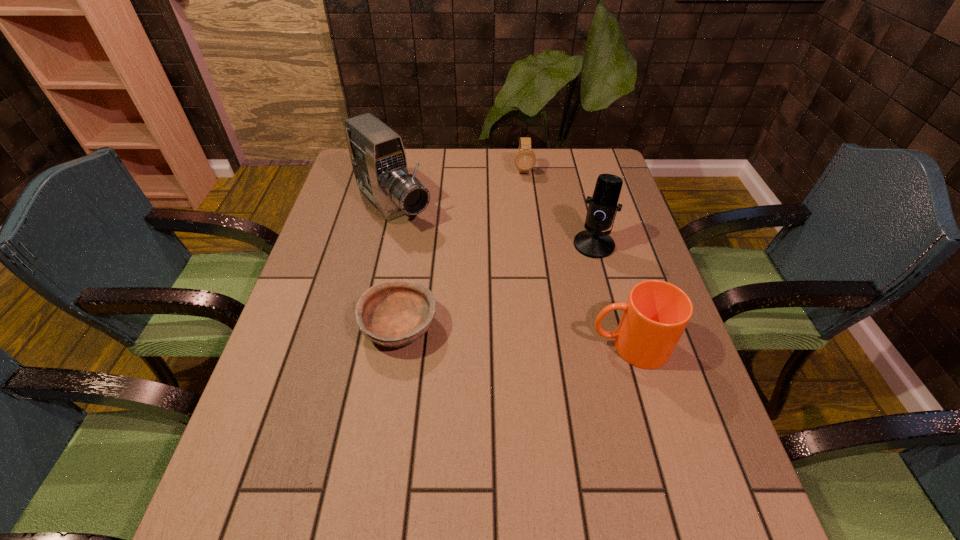
Identify the location of object that is the third nearest to the microphone. This screenshot has width=960, height=540. (393, 314).

Image resolution: width=960 pixels, height=540 pixels. Identify the location of the third closest object to the camcorder. (592, 242).

Image resolution: width=960 pixels, height=540 pixels. I want to click on vacant position in the image that satisfies the following two spatial constraints: 1. on the front side of the mug; 2. on the handle side of the third object from right to left, so click(x=545, y=346).

I want to click on free spot that satisfies the following two spatial constraints: 1. on the front side of the third shortest object; 2. on the handle side of the fourth shortest object, so click(621, 346).

Find the location of a particular element. This screenshot has width=960, height=540. free location that satisfies the following two spatial constraints: 1. on the front side of the third tallest object; 2. on the handle side of the microphone is located at coordinates (621, 346).

At what (x,y) coordinates should I click in order to perform the action: click on vacant space that satisfies the following two spatial constraints: 1. on the front side of the mug; 2. on the handle side of the bowl. Please return your answer as a coordinate pair (x, y). Looking at the image, I should click on click(396, 346).